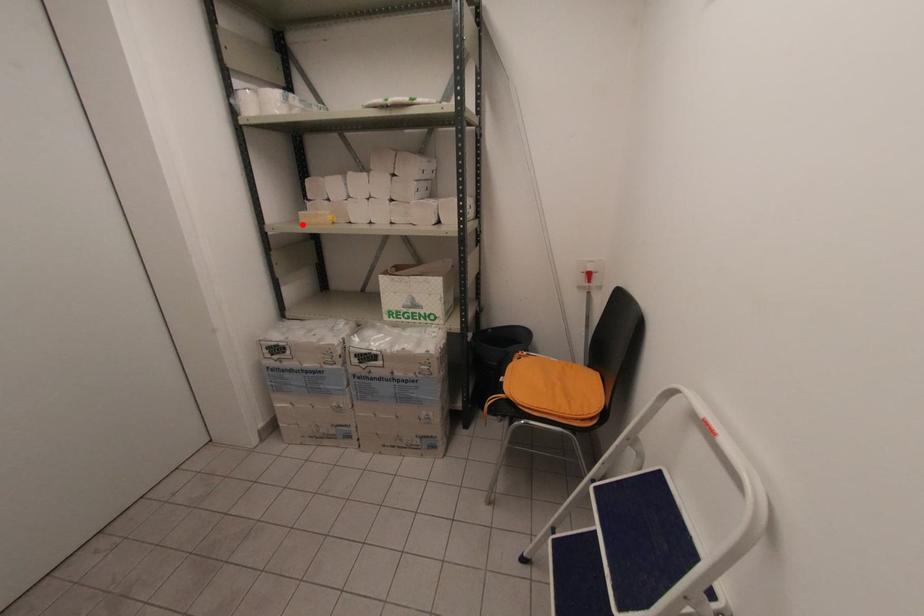
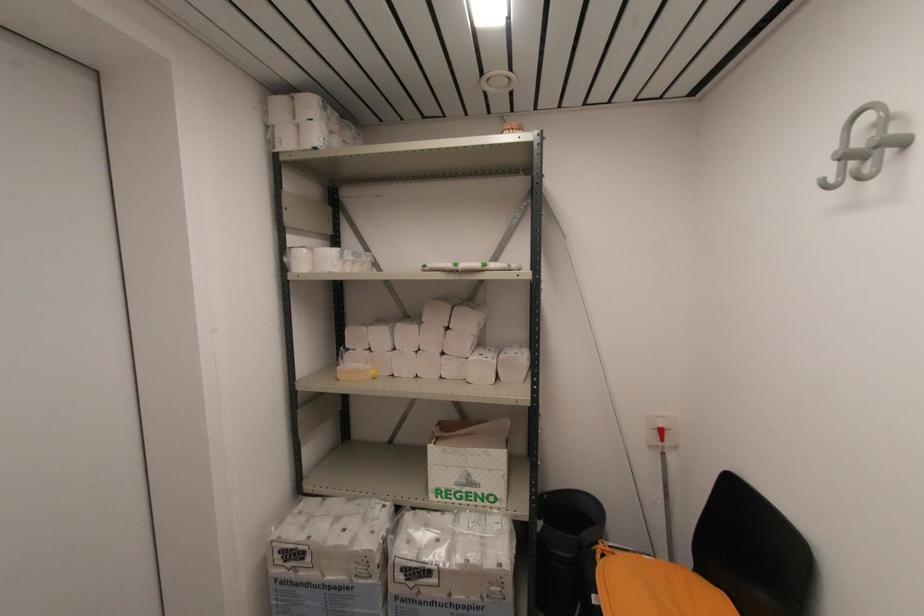
Find the pixel in the second image that matches the highlighted location in the first image.

(339, 381)